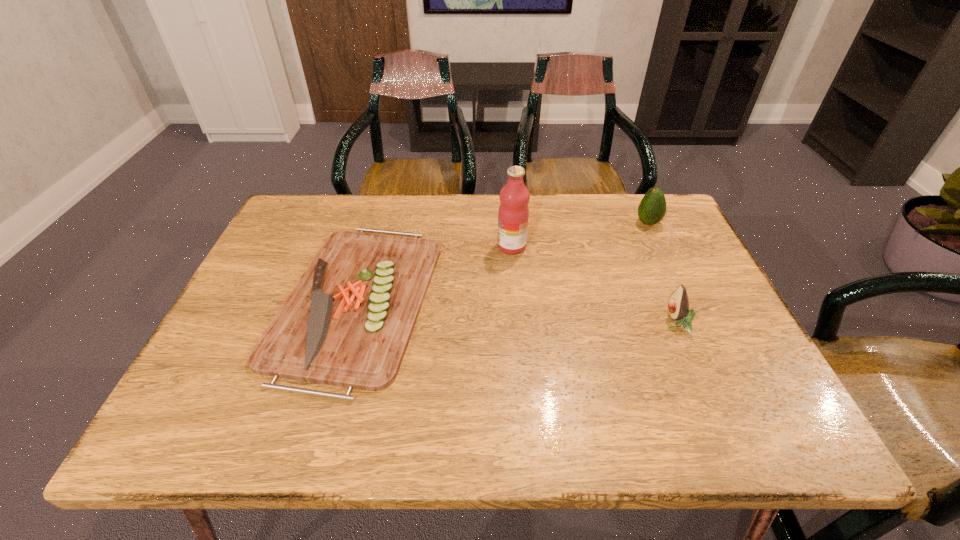
Image resolution: width=960 pixels, height=540 pixels. In order to click on vacant area that lies between the farther avocado and the tallest object in this screenshot , I will do `click(580, 234)`.

Where is `free point between the nearer avocado and the fruit juice`? Image resolution: width=960 pixels, height=540 pixels. free point between the nearer avocado and the fruit juice is located at coordinates (593, 285).

Locate an element on the screen. This screenshot has width=960, height=540. empty location between the nearer avocado and the tallest object is located at coordinates (593, 285).

This screenshot has height=540, width=960. I want to click on unoccupied position between the third object from right to left and the farther avocado, so click(x=580, y=234).

Find the location of a particular element. free space between the fruit juice and the leftmost object is located at coordinates (434, 273).

What are the coordinates of `empty location between the chopping board and the nearer avocado` in the screenshot? It's located at (516, 312).

Locate an element on the screen. This screenshot has height=540, width=960. free space between the nearer avocado and the farther avocado is located at coordinates (661, 273).

Choose which object is the second nearest neighbor to the tallest object. Please provide its 2D coordinates. Your answer should be formatted as a tuple, i.e. [(x, y)], where the tuple contains the x and y coordinates of a point satisfying the conditions above.

[(652, 208)]

Identify the location of object that stands as the closest to the nearer avocado. (652, 208).

Locate an element on the screen. vacant point that satisfies the following two spatial constraints: 1. on the front side of the farther avocado; 2. on the seed side of the nearer avocado is located at coordinates (695, 323).